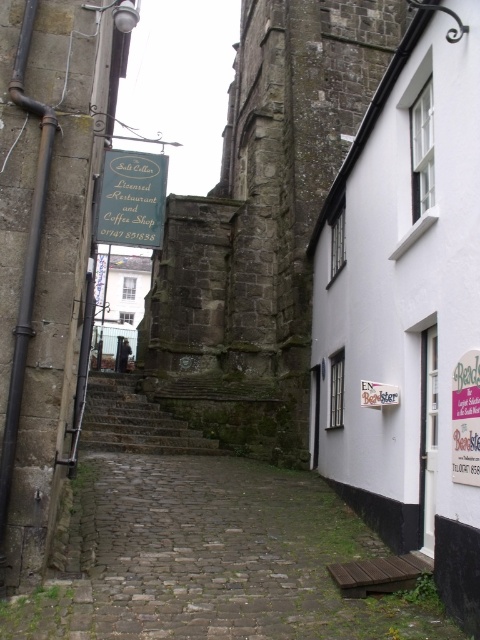
Question: Based on their relative distances, which object is nearer to the green painted wood signboard at center?

Choices:
 (A) stone textured tower at center
 (B) rusty stone stairs at center

Answer: (A)

Question: Among these objects, which one is farthest from the camera?

Choices:
 (A) green painted wood signboard at center
 (B) stone textured tower at center
 (C) rusty stone stairs at center

Answer: (C)

Question: Is rusty stone stairs at center smaller than green painted wood signboard at center?

Choices:
 (A) yes
 (B) no

Answer: (B)

Question: Does stone textured tower at center appear on the right side of rusty stone stairs at center?

Choices:
 (A) no
 (B) yes

Answer: (B)

Question: Which of the following is the closest to the observer?

Choices:
 (A) (120, 419)
 (B) (164, 240)
 (C) (142, 230)

Answer: (C)

Question: Can you confirm if stone textured tower at center is thinner than green painted wood signboard at center?

Choices:
 (A) no
 (B) yes

Answer: (A)